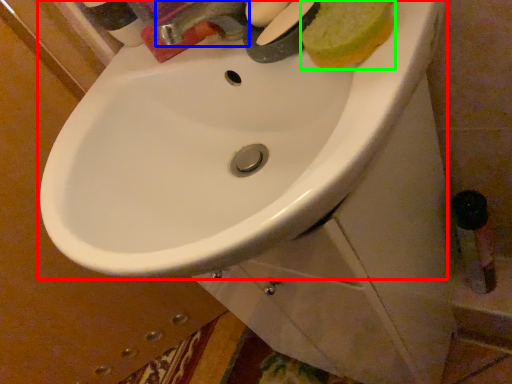
Question: Considering the real-world distances, which object is farthest from sink (highlighted by a red box)? tap (highlighted by a blue box) or food (highlighted by a green box)?

Choices:
 (A) tap
 (B) food

Answer: (B)